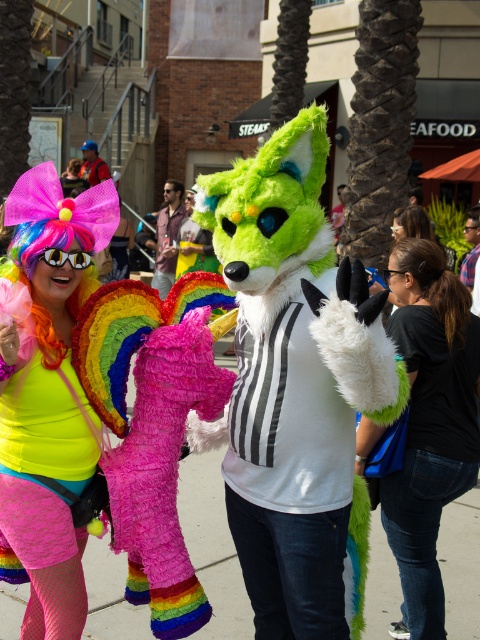
Question: Observing the image, what is the correct spatial positioning of black cotton t-shirt at center in reference to pavement at center?

Choices:
 (A) right
 (B) left

Answer: (A)

Question: Can you confirm if neon matte wig at upper left is bigger than brown fuzzy wig at upper right?

Choices:
 (A) no
 (B) yes

Answer: (B)

Question: Which is farther from the pavement at center?

Choices:
 (A) matte yellow goggles at center
 (B) neon matte wig at upper left

Answer: (A)

Question: Which of these objects is positioned farthest from the black cotton t-shirt at center?

Choices:
 (A) black hair at center
 (B) matte yellow goggles at center

Answer: (B)

Question: Is neon matte wig at upper left in front of matte yellow goggles at center?

Choices:
 (A) yes
 (B) no

Answer: (A)

Question: Which object is farther from the camera taking this photo?

Choices:
 (A) neon matte wig at upper left
 (B) brown fuzzy wig at upper right
 (C) black hair at center

Answer: (B)